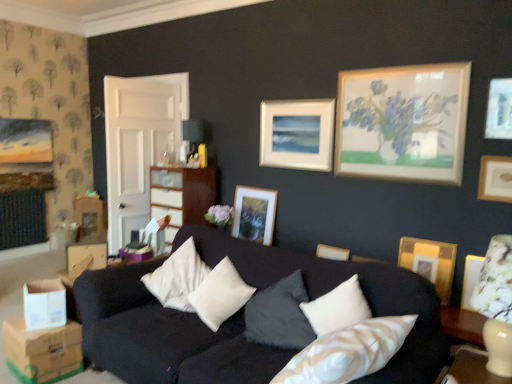
Locate an element on the screen. vacant area on top of matte white picture frame at center, which is counted as the third picture frame, starting from the right (from a real-world perspective) is located at coordinates (297, 102).